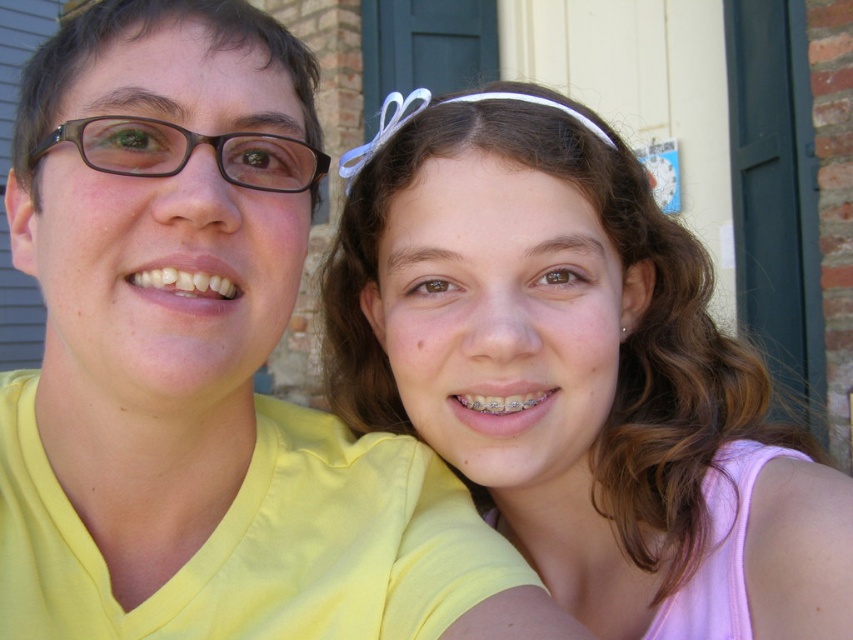
Question: Is pink fabric headband at upper center to the left of brown matte glasses at left from the viewer's perspective?

Choices:
 (A) no
 (B) yes

Answer: (A)

Question: Does yellow matte shirt at upper left appear under brown matte glasses at left?

Choices:
 (A) yes
 (B) no

Answer: (A)

Question: Which object is the closest to the pink fabric headband at upper center?

Choices:
 (A) brown matte glasses at left
 (B) yellow matte shirt at upper left

Answer: (B)

Question: Which point is farther to the camera?

Choices:
 (A) click(x=178, y=240)
 (B) click(x=694, y=572)

Answer: (B)

Question: Can you confirm if pink fabric headband at upper center is bigger than brown matte glasses at left?

Choices:
 (A) no
 (B) yes

Answer: (B)

Question: Among these objects, which one is farthest from the camera?

Choices:
 (A) brown matte glasses at left
 (B) yellow matte shirt at upper left

Answer: (A)